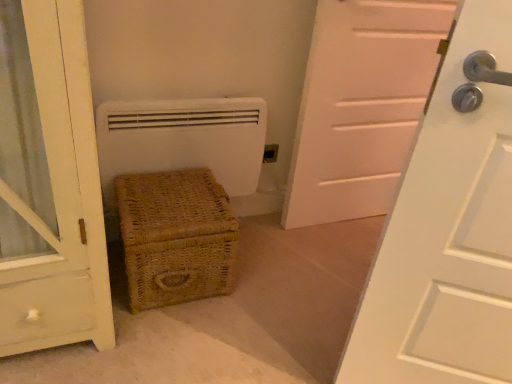
Find the location of `vacant area that lies in front of woven brown basket at lower left`. vacant area that lies in front of woven brown basket at lower left is located at coordinates (164, 343).